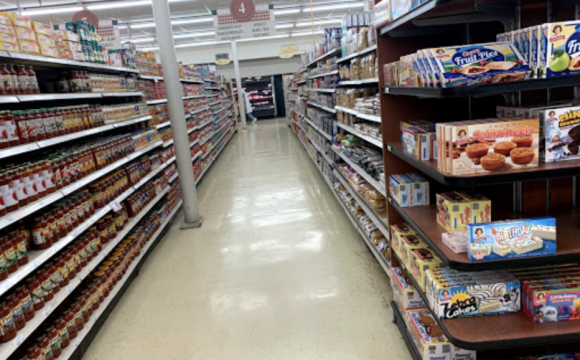
This screenshot has width=580, height=360. Identify the location of dark shelves. (474, 332), (420, 223), (429, 172), (432, 100), (429, 17).